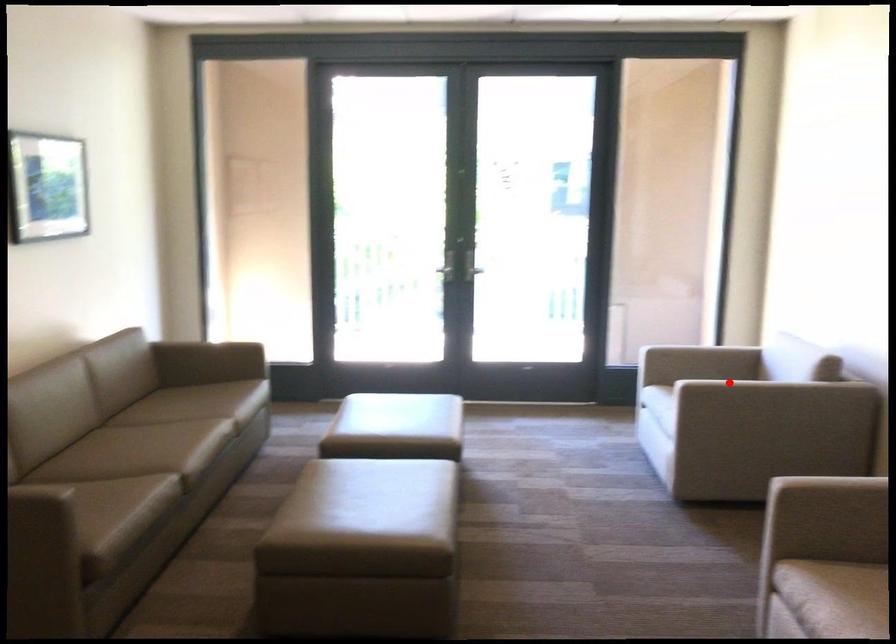
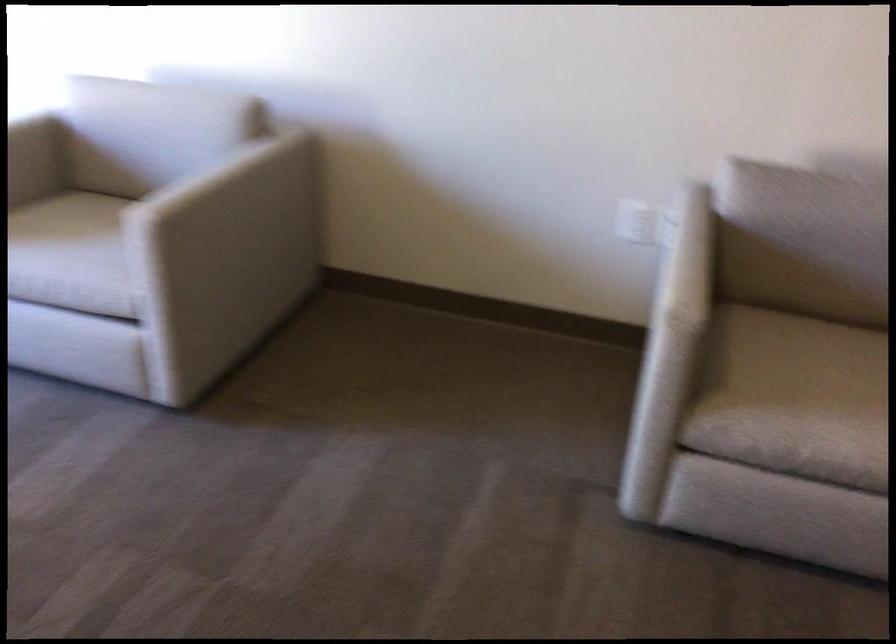
Question: I am providing you with two images of the same scene from different viewpoints. Given a red point in image1, look at the same physical point in image2. Is it:

Choices:
 (A) Closer to the viewpoint
 (B) Farther from the viewpoint

Answer: (A)